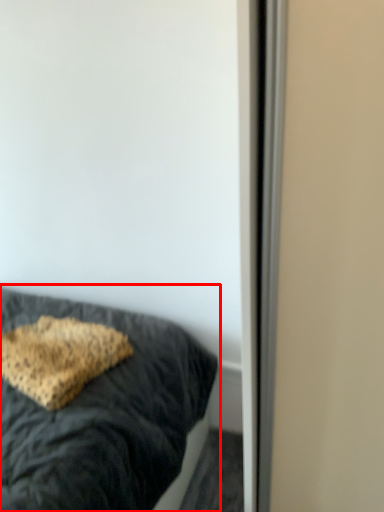
Question: Where is bed (annotated by the red box) located in relation to pillow in the image?

Choices:
 (A) right
 (B) left

Answer: (B)